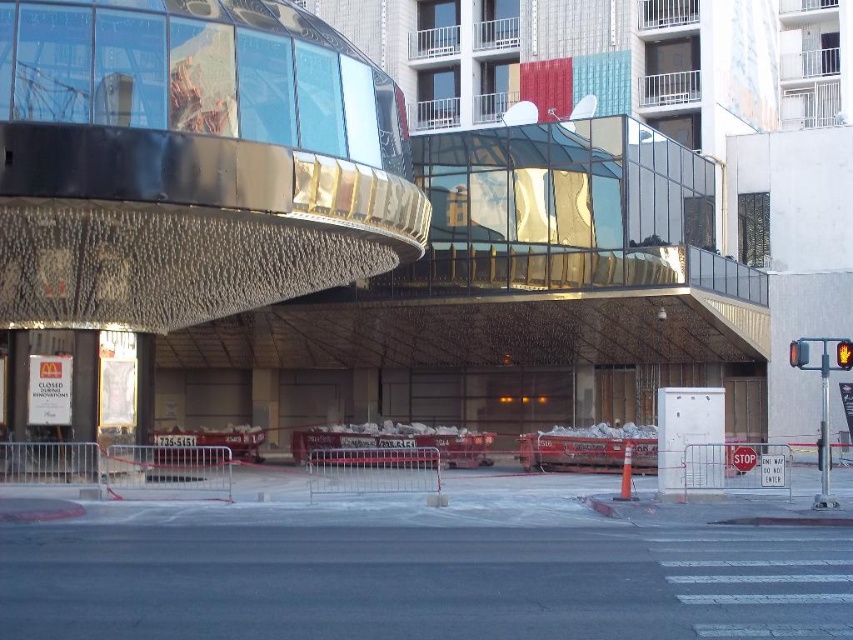
Is red glass traffic light at right bigger than yellow matte pedestrian signal at upper right?

Indeed, red glass traffic light at right has a larger size compared to yellow matte pedestrian signal at upper right.

Looking at this image, is red glass traffic light at right wider than yellow matte pedestrian signal at upper right?

Yes, red glass traffic light at right is wider than yellow matte pedestrian signal at upper right.

What do you see at coordinates (798, 353) in the screenshot?
I see `red glass traffic light at right` at bounding box center [798, 353].

What are the coordinates of `red glass traffic light at right` in the screenshot? It's located at (798, 353).